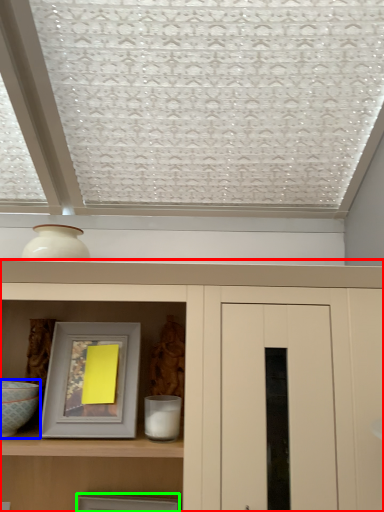
Question: Which object is the farthest from cupboard (highlighted by a red box)? Choose among these: glass bowl (highlighted by a blue box) or picture frame (highlighted by a green box).

Choices:
 (A) glass bowl
 (B) picture frame

Answer: (B)